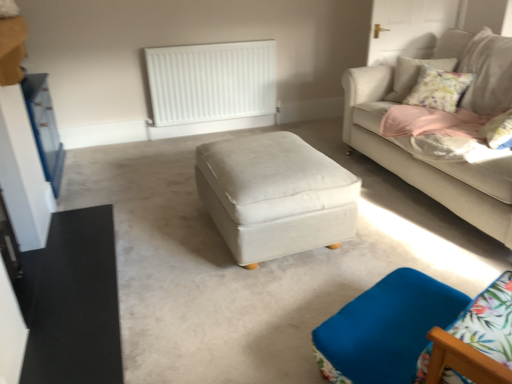
Locate an element on the screen. This screenshot has width=512, height=384. free space underneath white matte radiator at upper center (from a real-world perspective) is located at coordinates (214, 130).